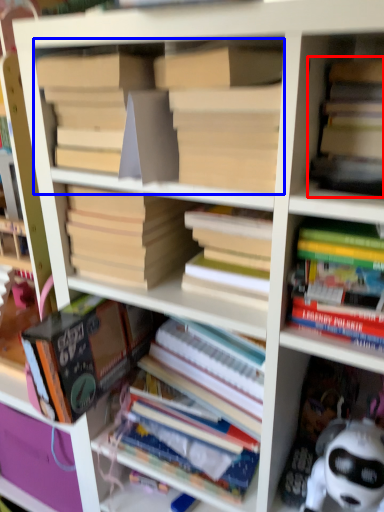
Question: Among these objects, which one is nearest to the camera, book (highlighted by a red box) or book (highlighted by a blue box)?

Choices:
 (A) book
 (B) book

Answer: (A)